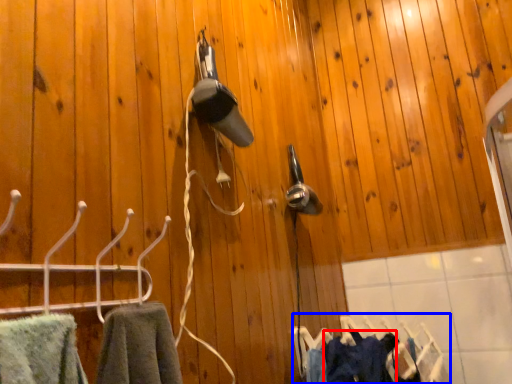
Question: Among these objects, which one is farthest to the camera, clothing (highlighted by a red box) or laundry (highlighted by a blue box)?

Choices:
 (A) clothing
 (B) laundry

Answer: (B)